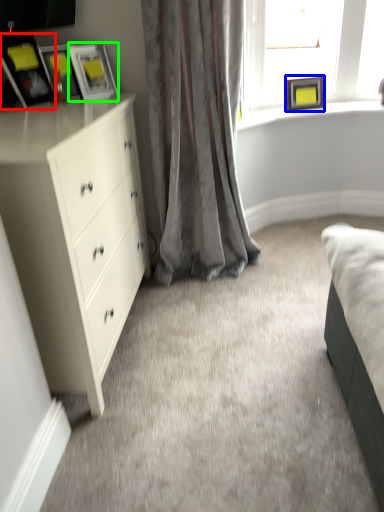
Question: Estimate the real-world distances between objects in this image. Which object is closer to picture frame (highlighted by a red box), picture frame (highlighted by a blue box) or picture frame (highlighted by a green box)?

Choices:
 (A) picture frame
 (B) picture frame

Answer: (B)